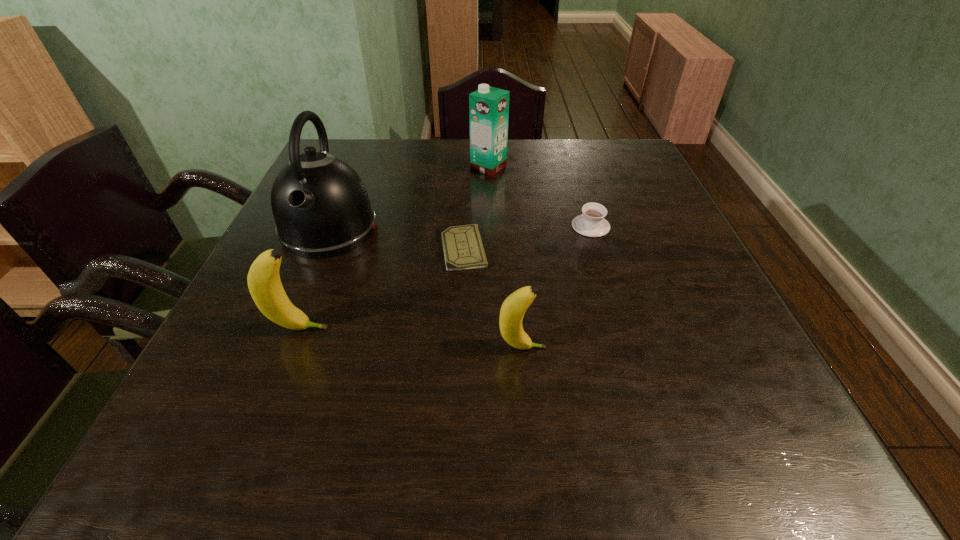
Locate an element on the screen. Image resolution: width=960 pixels, height=540 pixels. vacant space that's between the tallest object and the nearest object is located at coordinates (425, 288).

Find the location of a particular element. vacant space in between the farthest object and the fourth tallest object is located at coordinates (505, 258).

Locate an element on the screen. empty space that is in between the carton and the kettle is located at coordinates (409, 198).

Find the location of a particular element. This screenshot has height=540, width=960. free space between the rightmost object and the taller banana is located at coordinates (445, 278).

Where is `free space between the shortest object and the left banana`? free space between the shortest object and the left banana is located at coordinates (381, 289).

The image size is (960, 540). Find the location of `vacant region between the checkbook and the kettle`. vacant region between the checkbook and the kettle is located at coordinates (396, 239).

Identify the location of vacant point located between the left banana and the teacup. The image size is (960, 540). (445, 278).

This screenshot has height=540, width=960. I want to click on object that is the closest to the tallest object, so click(462, 245).

At what (x,y) coordinates should I click in order to perform the action: click on the second closest object to the left banana. Please return your answer as a coordinate pair (x, y). Looking at the image, I should click on (462, 245).